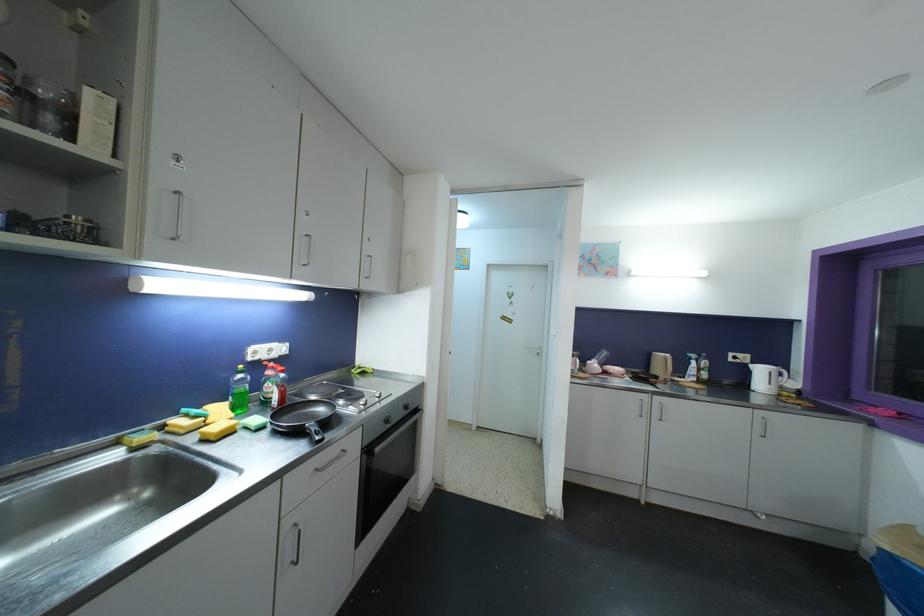
Find where to grip the white kettle handle. Please return your answer as a coordinate pair (x, y).

(784, 371)